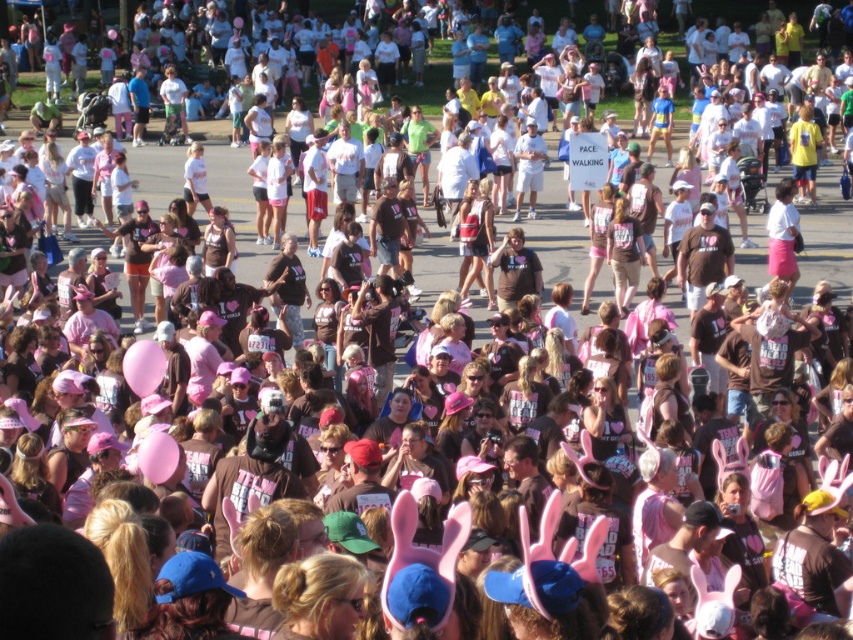
You are organizing a community event and need to decide which balloon to use for a decoration that requires a wider balloon. Given the scene, which balloon between the pink rubber balloon at center and the pink fabric balloon at center should you choose?

The pink rubber balloon at center has a greater width than the pink fabric balloon at center, so you should choose the pink rubber balloon at center for the decoration that requires a wider balloon.

You are standing at the camera position and want to reach point (132, 385). If you can walk 2 meters per second, how long will it take you to reach there?

The distance between you and point (132, 385) is 23.81 meters. At a walking speed of 2 meters per second, it will take approximately 11.9 seconds to reach the point.

You are a photographer at the event and want to capture a photo of both the pink rubber balloon at center and the pink fabric balloon at center. Which balloon should you focus on first to ensure both are in the frame?

You should focus on the pink rubber balloon at center first because it is above the pink fabric balloon at center, so adjusting the camera angle to include the higher balloon will naturally include the lower one in the frame.